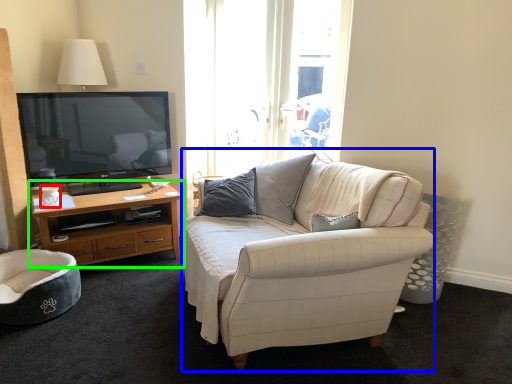
Question: Estimate the real-world distances between objects in this image. Which object is closer to coffee cup (highlighted by a red box), studio couch (highlighted by a blue box) or cabinetry (highlighted by a green box)?

Choices:
 (A) studio couch
 (B) cabinetry

Answer: (B)